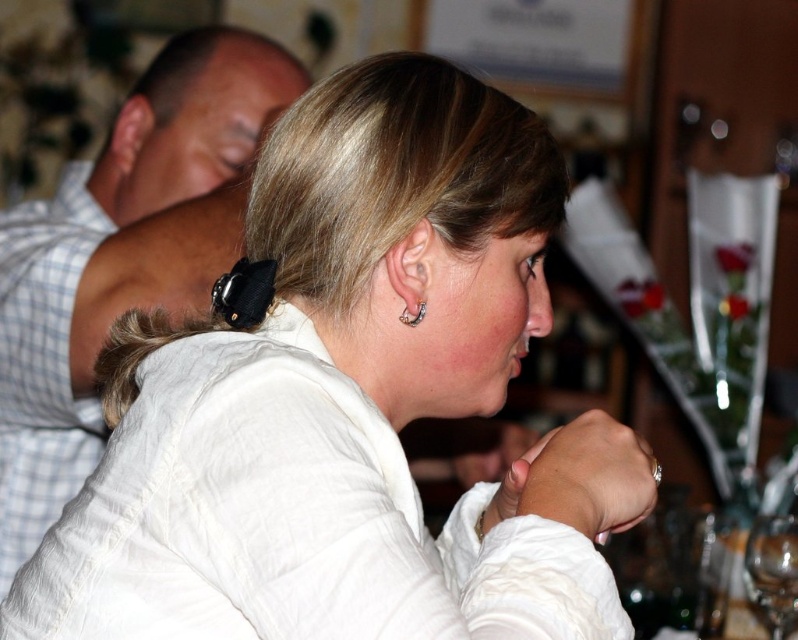
From the picture: Does white checkered fabric at upper left appear under brown fuzzy hair at upper left?

No, white checkered fabric at upper left is not below brown fuzzy hair at upper left.

Which is behind, point (30, 532) or point (141, 337)?

The point (30, 532) is behind.

You are a GUI agent. You are given a task and a screenshot of the screen. Output one action in this format:
    pyautogui.click(x=<x>, y=<y>)
    Task: Click on the white checkered fabric at upper left
    The height and width of the screenshot is (640, 798).
    Given the screenshot: What is the action you would take?
    pyautogui.click(x=42, y=364)

Does brown fuzzy hair at upper left appear on the right side of transparent glass at lower right?

Incorrect, brown fuzzy hair at upper left is not on the right side of transparent glass at lower right.

Between point (135, 352) and point (763, 582), which one is positioned in front?

Positioned in front is point (135, 352).

Image resolution: width=798 pixels, height=640 pixels. I want to click on brown fuzzy hair at upper left, so click(140, 353).

Can you confirm if white checkered fabric at upper left is smaller than silver metallic earring at ear?

No, white checkered fabric at upper left is not smaller than silver metallic earring at ear.

Can you confirm if white checkered fabric at upper left is shorter than silver metallic earring at ear?

Incorrect, white checkered fabric at upper left's height does not fall short of silver metallic earring at ear's.

Does point (70, 179) come farther from viewer compared to point (423, 307)?

Yes, it is.

Where is `white checkered fabric at upper left`? white checkered fabric at upper left is located at coordinates (42, 364).